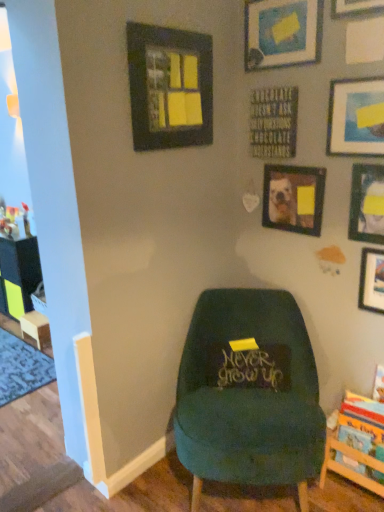
Question: Is wooden at left shorter than velvet green chair at center?

Choices:
 (A) yes
 (B) no

Answer: (A)

Question: Is velvet green chair at center located within wooden at left?

Choices:
 (A) no
 (B) yes

Answer: (A)

Question: Does wooden at left have a smaller size compared to velvet green chair at center?

Choices:
 (A) no
 (B) yes

Answer: (B)

Question: Is wooden at left positioned with its back to velvet green chair at center?

Choices:
 (A) no
 (B) yes

Answer: (A)

Question: Is the depth of wooden at left less than that of velvet green chair at center?

Choices:
 (A) yes
 (B) no

Answer: (B)

Question: From a real-world perspective, is matte black picture frame at upper center, marked as the sixth picture frame in a right-to-left arrangement, above or below matte black sign at center?

Choices:
 (A) below
 (B) above

Answer: (B)

Question: Is matte black picture frame at upper center, marked as the sixth picture frame in a right-to-left arrangement, wider or thinner than matte black sign at center?

Choices:
 (A) thin
 (B) wide

Answer: (A)

Question: Is matte black picture frame at upper center, marked as the sixth picture frame in a right-to-left arrangement, situated inside matte black sign at center or outside?

Choices:
 (A) inside
 (B) outside

Answer: (B)

Question: Is matte black picture frame at upper center, the second picture frame from the left, taller or shorter than matte black sign at center?

Choices:
 (A) short
 (B) tall

Answer: (B)

Question: From a real-world perspective, relative to wooden picture frame at upper right, the fourth picture frame when ordered from right to left, is wooden at left vertically above or below?

Choices:
 (A) below
 (B) above

Answer: (A)

Question: Do you think wooden at left is within wooden picture frame at upper right, the 4th picture frame from the left, or outside of it?

Choices:
 (A) outside
 (B) inside

Answer: (A)

Question: Considering the positions of point [31, 311] and point [374, 5], is point [31, 311] closer or farther from the camera than point [374, 5]?

Choices:
 (A) closer
 (B) farther

Answer: (B)

Question: Is wooden at left in front of or behind wooden picture frame at upper right, the fourth picture frame when ordered from right to left, in the image?

Choices:
 (A) behind
 (B) front

Answer: (A)

Question: Relative to matte black picture frame at upper right, the 2th picture frame in the right-to-left sequence, is wooden picture frame at center, which is the fifth picture frame from right to left, in front or behind?

Choices:
 (A) front
 (B) behind

Answer: (B)

Question: In terms of size, does wooden picture frame at center, which is the fifth picture frame from right to left, appear bigger or smaller than matte black picture frame at upper right, the 6th picture frame in the left-to-right sequence?

Choices:
 (A) big
 (B) small

Answer: (A)